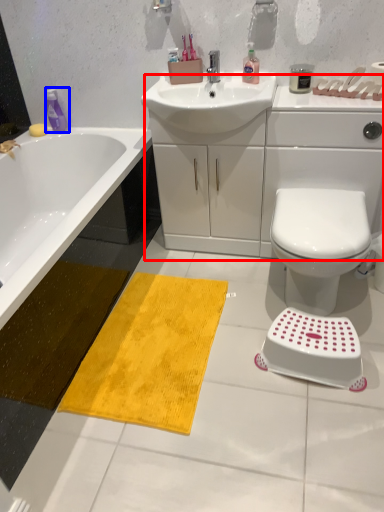
Question: Among these objects, which one is nearest to the camera, counter top (highlighted by a red box) or cleaning product (highlighted by a blue box)?

Choices:
 (A) counter top
 (B) cleaning product

Answer: (A)